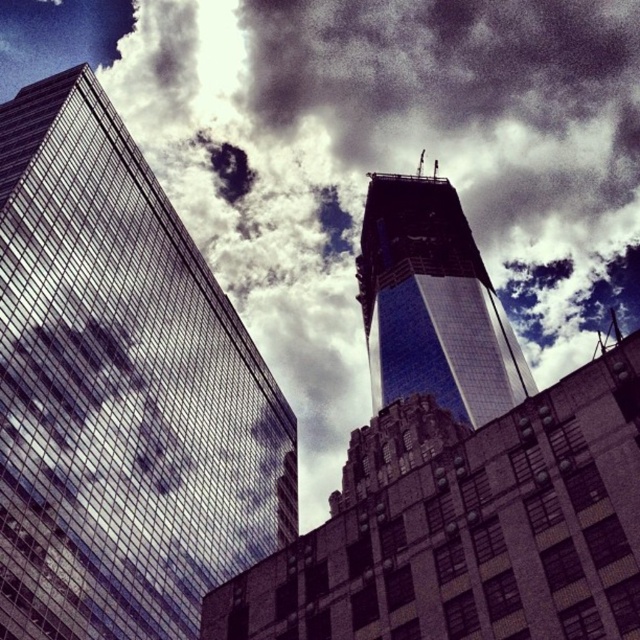
Question: Does reflective glass skyscraper at left lie in front of blue glass skyscraper at center?

Choices:
 (A) yes
 (B) no

Answer: (A)

Question: Is reflective glass skyscraper at left to the right of blue glass skyscraper at center from the viewer's perspective?

Choices:
 (A) no
 (B) yes

Answer: (A)

Question: Is reflective glass skyscraper at left thinner than blue glass skyscraper at center?

Choices:
 (A) no
 (B) yes

Answer: (A)

Question: Which object is farther from the camera taking this photo?

Choices:
 (A) reflective glass skyscraper at left
 (B) blue glass skyscraper at center

Answer: (B)

Question: Among these points, which one is nearest to the camera?

Choices:
 (A) (97, 253)
 (B) (516, 349)

Answer: (A)